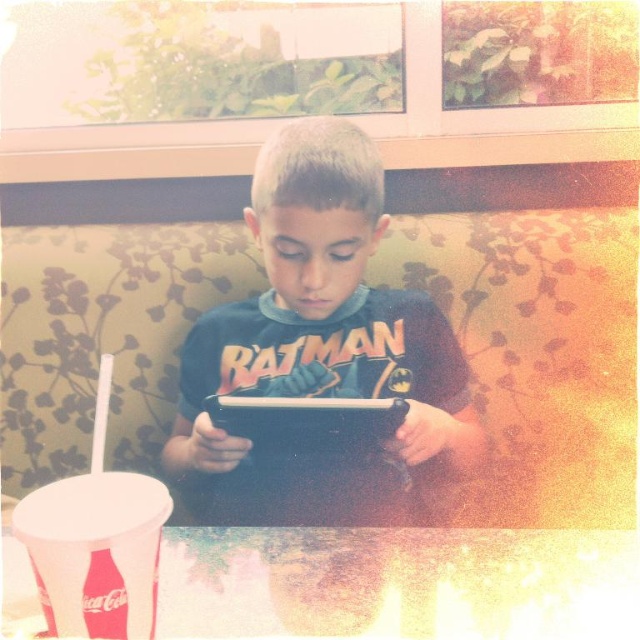
Can you confirm if matte black shirt at center is positioned below black matte tablet at center?

No.

Is point (458, 452) behind point (358, 412)?

Yes, it is behind point (358, 412).

Is point (369, 342) behind point (320, 426)?

Yes, it is.

The width and height of the screenshot is (640, 640). Find the location of `matte black shirt at center`. matte black shirt at center is located at coordinates (321, 349).